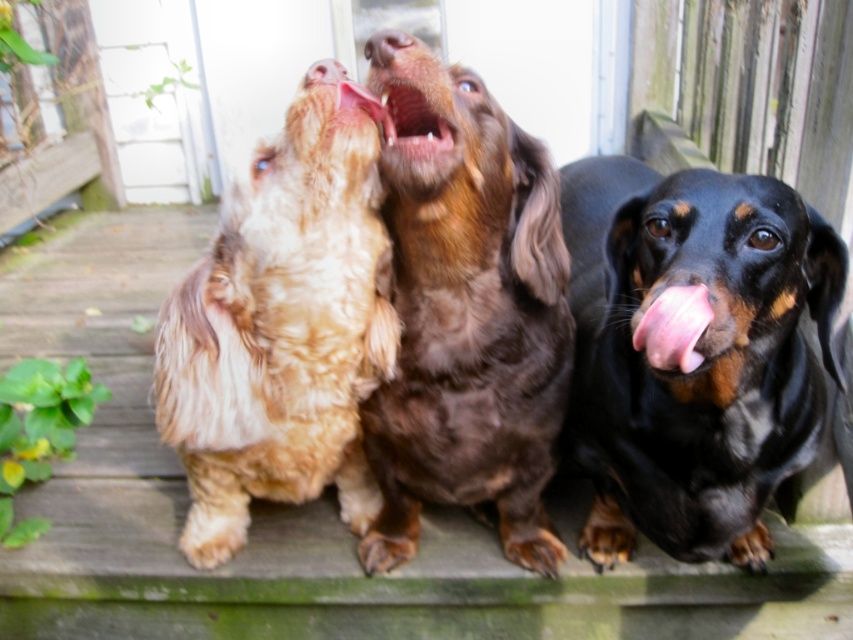
Who is higher up, shaggy golden-brown dog at center or matte brown nose at center?

matte brown nose at center is above.

Is point (305, 484) positioned after point (370, 61)?

That is True.

Where is `shaggy golden-brown dog at center`? The width and height of the screenshot is (853, 640). shaggy golden-brown dog at center is located at coordinates (282, 328).

Where is `shaggy golden-brown dog at center`? shaggy golden-brown dog at center is located at coordinates (282, 328).

Is pink flesh at center below brown fur nose at upper center?

Correct, pink flesh at center is located below brown fur nose at upper center.

Can you confirm if pink flesh at center is shorter than brown fur nose at upper center?

Incorrect, pink flesh at center's height does not fall short of brown fur nose at upper center's.

Is point (674, 364) in front of point (344, 77)?

That is True.

At what (x,y) coordinates should I click in order to perform the action: click on pink flesh at center. Please return your answer as a coordinate pair (x, y). The height and width of the screenshot is (640, 853). Looking at the image, I should click on [672, 326].

In the scene shown: Can you confirm if pink flesh at center is positioned to the right of pink glossy tongue at center?

Indeed, pink flesh at center is positioned on the right side of pink glossy tongue at center.

Does pink flesh at center come in front of pink glossy tongue at center?

Yes, it is in front of pink glossy tongue at center.

This screenshot has height=640, width=853. What do you see at coordinates (672, 326) in the screenshot?
I see `pink flesh at center` at bounding box center [672, 326].

The height and width of the screenshot is (640, 853). I want to click on pink flesh at center, so tap(672, 326).